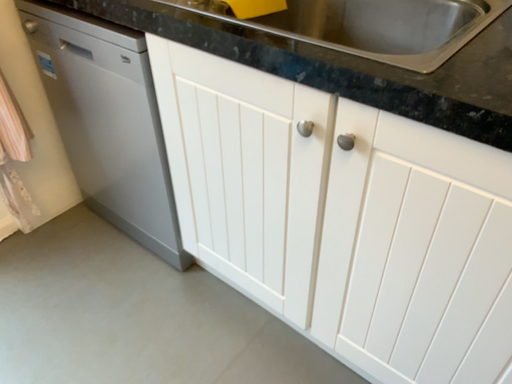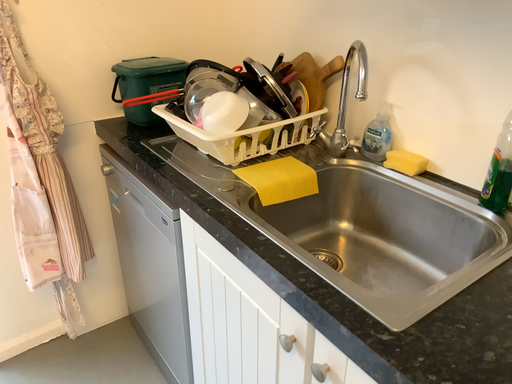
Question: Which way did the camera rotate in the video?

Choices:
 (A) rotated left
 (B) rotated right

Answer: (A)